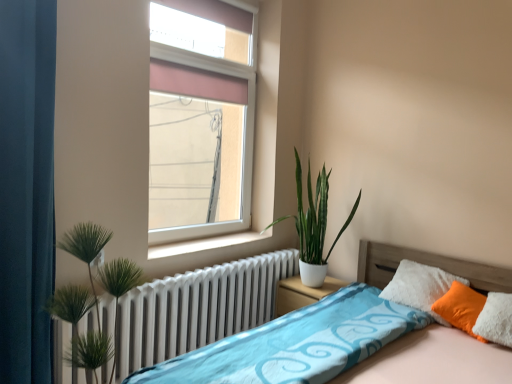
What do you see at coordinates (197, 308) in the screenshot? The image size is (512, 384). I see `white metallic radiator at lower left` at bounding box center [197, 308].

Describe the element at coordinates (461, 308) in the screenshot. I see `orange fabric pillow at right` at that location.

Locate an element on the screen. white smooth window sill at center is located at coordinates (204, 244).

Locate an element on the screen. The image size is (512, 384). blue fabric bed at lower right is located at coordinates (434, 360).

Image resolution: width=512 pixels, height=384 pixels. Describe the element at coordinates (313, 225) in the screenshot. I see `green glossy plant at center` at that location.

Image resolution: width=512 pixels, height=384 pixels. I want to click on pink fabric window at upper center, so click(204, 124).

Which of these two, green glossy plant at center or white metallic radiator at lower left, is bigger?

Bigger between the two is green glossy plant at center.

Is green glossy plant at center in contact with white metallic radiator at lower left?

No.

Based on their positions, is green glossy plant at center located to the left or right of white metallic radiator at lower left?

From the image, it's evident that green glossy plant at center is to the right of white metallic radiator at lower left.

Where is `radiator that appears below the green glossy plant at center (from the image's perspective)`? radiator that appears below the green glossy plant at center (from the image's perspective) is located at coordinates (197, 308).

From a real-world perspective, is green glossy plant at center positioned above or below white smooth window sill at center?

From a real-world perspective, green glossy plant at center is physically above white smooth window sill at center.

Can you confirm if green glossy plant at center is taller than white smooth window sill at center?

Indeed, green glossy plant at center has a greater height compared to white smooth window sill at center.

Is green glossy plant at center touching white smooth window sill at center?

There is a gap between green glossy plant at center and white smooth window sill at center.

Who is bigger, green glossy plant at center or white smooth window sill at center?

green glossy plant at center.

Does green leafy plant at left have a smaller size compared to blue fabric bed at lower right?

Yes, green leafy plant at left is smaller than blue fabric bed at lower right.

Is green leafy plant at left to the right of blue fabric bed at lower right from the viewer's perspective?

Incorrect, green leafy plant at left is not on the right side of blue fabric bed at lower right.

Can you tell me how much green leafy plant at left and blue fabric bed at lower right differ in facing direction?

The facing directions of green leafy plant at left and blue fabric bed at lower right are 96.4 degrees apart.

Would you say green leafy plant at left is a long distance from blue fabric bed at lower right?

Absolutely, green leafy plant at left is distant from blue fabric bed at lower right.

From the image's perspective, would you say pink fabric window at upper center is shown under green glossy plant at center?

Incorrect, from the image's perspective, pink fabric window at upper center is higher than green glossy plant at center.

Is the depth of pink fabric window at upper center greater than that of green glossy plant at center?

No, pink fabric window at upper center is closer to the viewer.

Identify the location of houseplant located behind the pink fabric window at upper center. This screenshot has height=384, width=512. (313, 225).

Which of these two, pink fabric window at upper center or green glossy plant at center, is bigger?

green glossy plant at center is bigger.

Locate an element on the screen. This screenshot has height=384, width=512. bed in front of the orange fabric pillow at right is located at coordinates (434, 360).

Is there a large distance between blue fabric bed at lower right and orange fabric pillow at right?

No, blue fabric bed at lower right is not far from orange fabric pillow at right.

Could you tell me if blue fabric bed at lower right is facing orange fabric pillow at right?

No, blue fabric bed at lower right is not turned towards orange fabric pillow at right.

From a real-world perspective, is green leafy plant at left positioned over orange fabric pillow at right based on gravity?

Yes, from a real-world perspective, green leafy plant at left is over orange fabric pillow at right

Is green leafy plant at left closer to camera compared to orange fabric pillow at right?

Yes, green leafy plant at left is closer to the viewer.

Is green leafy plant at left shorter than orange fabric pillow at right?

Incorrect, the height of green leafy plant at left does not fall short of that of orange fabric pillow at right.

Considering the sizes of objects white smooth window sill at center and pink fabric window at upper center in the image provided, who is wider, white smooth window sill at center or pink fabric window at upper center?

white smooth window sill at center is wider.

You are a GUI agent. You are given a task and a screenshot of the screen. Output one action in this format:
    pyautogui.click(x=<x>, y=<y>)
    Task: Click on the window sill below the pink fabric window at upper center (from the image's perspective)
    Image resolution: width=512 pixels, height=384 pixels.
    Given the screenshot: What is the action you would take?
    pyautogui.click(x=204, y=244)

Choose the correct answer: Is white smooth window sill at center inside pink fabric window at upper center or outside it?

white smooth window sill at center is located beyond the bounds of pink fabric window at upper center.

From the image's perspective, is white smooth window sill at center on top of pink fabric window at upper center?

No, from the image's perspective, white smooth window sill at center is not over pink fabric window at upper center.

In the image, there is a white metallic radiator at lower left. Identify the location of houseplant above it (from the image's perspective). (313, 225).

I want to click on window sill located on the left of green glossy plant at center, so click(204, 244).

When comparing their distances from green glossy plant at center, does orange fabric pillow at right or white metallic radiator at lower left seem further?

The object further to green glossy plant at center is orange fabric pillow at right.

In the scene shown: Looking at the image, which one is located closer to white matte nightstand at center, white metallic radiator at lower left or pink fabric window at upper center?

Among the two, white metallic radiator at lower left is located nearer to white matte nightstand at center.

Looking at the image, which one is located further to white matte nightstand at center, blue fabric bed at lower right or teal fabric curtain at left?

teal fabric curtain at left lies further to white matte nightstand at center than the other object.

When comparing their distances from teal fabric curtain at left, does green glossy plant at center or green leafy plant at left seem closer?

Among the two, green leafy plant at left is located nearer to teal fabric curtain at left.

Considering their positions, is white matte nightstand at center positioned further to white metallic radiator at lower left than pink fabric window at upper center?

The object further to white metallic radiator at lower left is pink fabric window at upper center.

Based on their spatial positions, is blue fabric bed at lower right or white matte nightstand at center further from green leafy plant at left?

white matte nightstand at center is positioned further to the anchor green leafy plant at left.

From the picture: Which object lies nearer to the anchor point teal fabric curtain at left, white smooth window sill at center or blue fabric bed at lower right?

white smooth window sill at center is positioned closer to the anchor teal fabric curtain at left.

Estimate the real-world distances between objects in this image. Which object is closer to white metallic radiator at lower left, orange fabric pillow at right or teal fabric curtain at left?

teal fabric curtain at left.

Locate an element on the screen. This screenshot has width=512, height=384. window situated between teal fabric curtain at left and orange fabric pillow at right from left to right is located at coordinates (204, 124).

Identify the location of radiator between blue fabric bed at lower right and white matte nightstand at center in the front-back direction. This screenshot has height=384, width=512. (197, 308).

Where is `window between teal fabric curtain at left and green glossy plant at center in the horizontal direction`? This screenshot has width=512, height=384. window between teal fabric curtain at left and green glossy plant at center in the horizontal direction is located at coordinates (204, 124).

You are a GUI agent. You are given a task and a screenshot of the screen. Output one action in this format:
    pyautogui.click(x=<x>, y=<y>)
    Task: Click on the window sill that lies between pink fabric window at upper center and green leafy plant at left from top to bottom
    Image resolution: width=512 pixels, height=384 pixels.
    Given the screenshot: What is the action you would take?
    pyautogui.click(x=204, y=244)